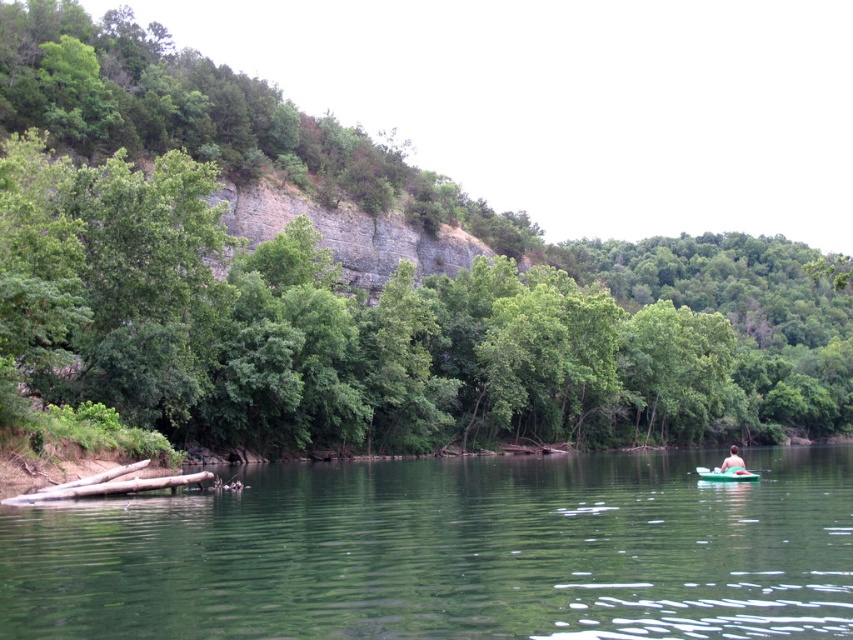
Question: Is green leafy tree at center to the right of green plastic canoe at lower right from the viewer's perspective?

Choices:
 (A) yes
 (B) no

Answer: (A)

Question: Can you confirm if green smooth water at center is wider than green plastic canoe at lower right?

Choices:
 (A) yes
 (B) no

Answer: (A)

Question: Is green plastic canoe at lower right bigger than pink fabric kayak at lower right?

Choices:
 (A) no
 (B) yes

Answer: (A)

Question: Which point is closer to the camera?

Choices:
 (A) (732, 468)
 (B) (413, 493)
 (C) (39, 244)
 (D) (735, 451)

Answer: (B)

Question: Among these objects, which one is nearest to the camera?

Choices:
 (A) green leafy tree at center
 (B) green smooth water at center
 (C) pink fabric kayak at lower right

Answer: (B)

Question: Which is nearer to the green plastic canoe at lower right?

Choices:
 (A) green leafy tree at center
 (B) pink fabric kayak at lower right
 (C) green smooth water at center

Answer: (B)